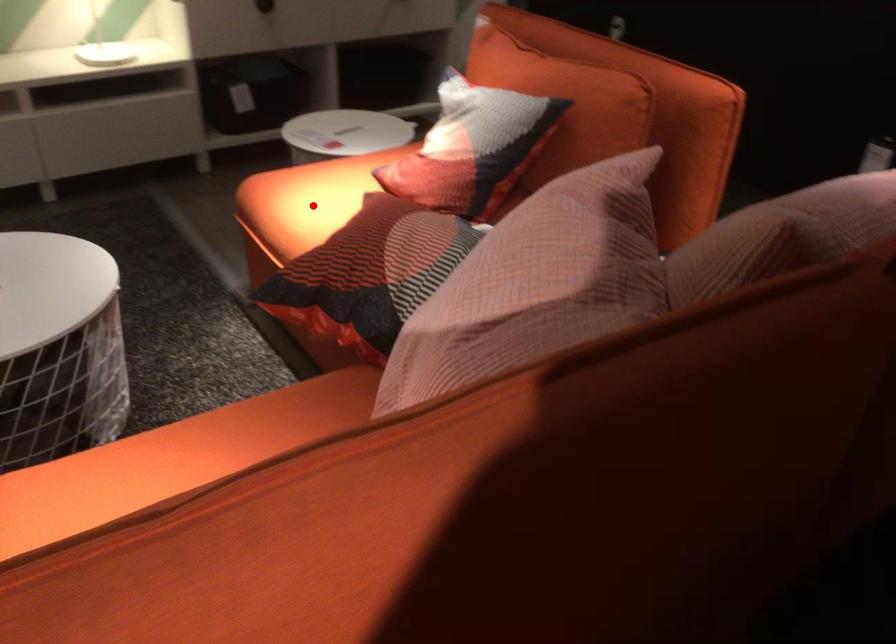
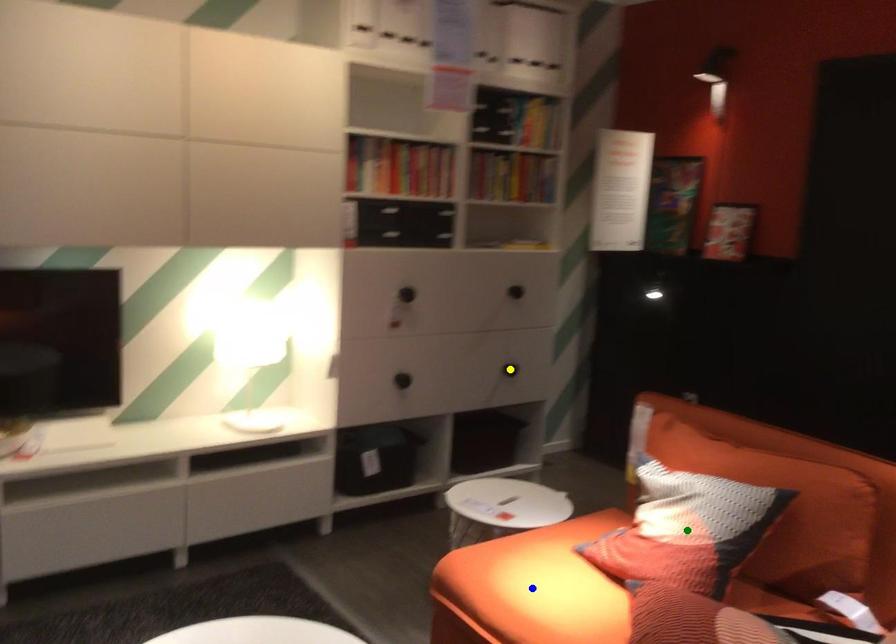
Question: I am providing you with two images of the same scene from different viewpoints. A red point is marked on the first image. You are given multiple points on the second image. Which point in image 2 is actually the same real-world point as the red point in image 1?

Choices:
 (A) blue point
 (B) yellow point
 (C) green point

Answer: (A)